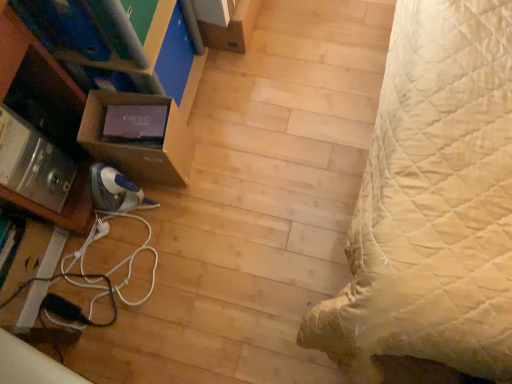
Where is `unoccupied region to the right of brown cardboard box at left, placed as the 1th shelf when sorted from right to left`? The height and width of the screenshot is (384, 512). unoccupied region to the right of brown cardboard box at left, placed as the 1th shelf when sorted from right to left is located at coordinates (219, 140).